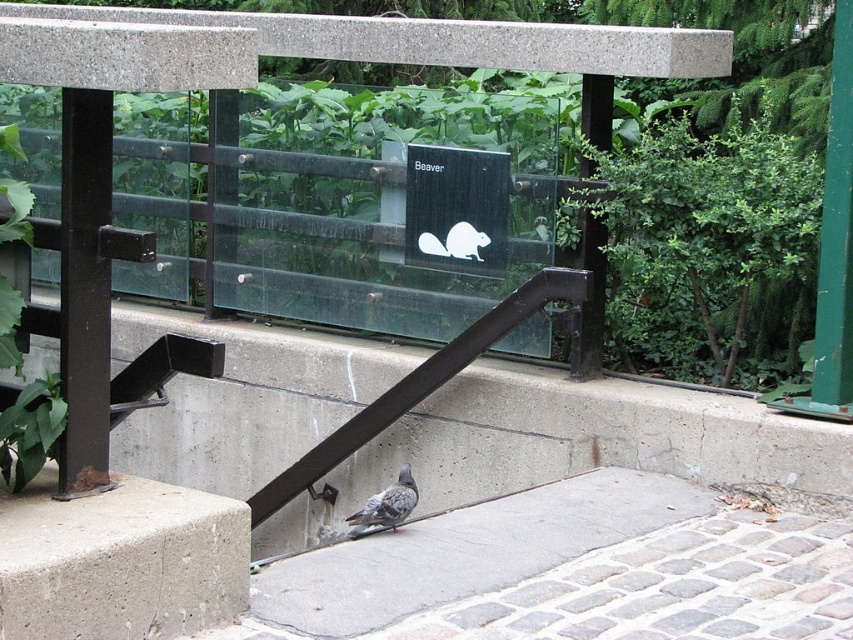
Question: Is the position of gray concrete sidewalk at center more distant than that of gray speckled pigeon at lower center?

Choices:
 (A) no
 (B) yes

Answer: (A)

Question: Estimate the real-world distances between objects in this image. Which object is closer to the white matte beaver at center?

Choices:
 (A) gray speckled pigeon at lower center
 (B) gray concrete sidewalk at center
 (C) gray concrete block at lower left

Answer: (A)

Question: Which point is closer to the camera?

Choices:
 (A) gray concrete sidewalk at center
 (B) gray speckled pigeon at lower center

Answer: (A)

Question: Among these points, which one is nearest to the camera?

Choices:
 (A) (401, 467)
 (B) (663, 515)
 (C) (473, 257)
 (D) (129, 608)

Answer: (D)

Question: Is the position of gray concrete sidewalk at center less distant than that of white matte beaver at center?

Choices:
 (A) no
 (B) yes

Answer: (B)

Question: From the image, what is the correct spatial relationship of gray speckled pigeon at lower center in relation to white matte beaver at center?

Choices:
 (A) below
 (B) above

Answer: (A)